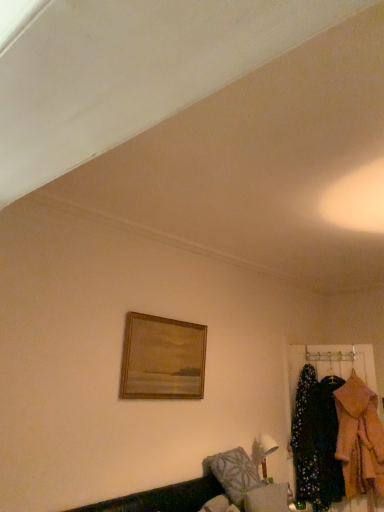
Question: Considering the relative positions of fluffy gray pillow at lower center and wooden framed painting at upper center in the image provided, is fluffy gray pillow at lower center behind wooden framed painting at upper center?

Choices:
 (A) yes
 (B) no

Answer: (A)

Question: Considering the relative sizes of fluffy gray pillow at lower center and wooden framed painting at upper center in the image provided, is fluffy gray pillow at lower center wider than wooden framed painting at upper center?

Choices:
 (A) no
 (B) yes

Answer: (B)

Question: From the image's perspective, is fluffy gray pillow at lower center located above wooden framed painting at upper center?

Choices:
 (A) yes
 (B) no

Answer: (B)

Question: Can you confirm if fluffy gray pillow at lower center is thinner than wooden framed painting at upper center?

Choices:
 (A) no
 (B) yes

Answer: (A)

Question: Does fluffy gray pillow at lower center touch wooden framed painting at upper center?

Choices:
 (A) yes
 (B) no

Answer: (B)

Question: Is fluffy gray pillow at lower center turned away from wooden framed painting at upper center?

Choices:
 (A) no
 (B) yes

Answer: (A)

Question: From a real-world perspective, is fluffy pink coat at right on fluffy gray pillow at lower center?

Choices:
 (A) no
 (B) yes

Answer: (B)

Question: Considering the relative sizes of fluffy pink coat at right and fluffy gray pillow at lower center in the image provided, is fluffy pink coat at right wider than fluffy gray pillow at lower center?

Choices:
 (A) no
 (B) yes

Answer: (A)

Question: Is fluffy pink coat at right at the left side of fluffy gray pillow at lower center?

Choices:
 (A) no
 (B) yes

Answer: (A)

Question: From the image's perspective, is fluffy pink coat at right below fluffy gray pillow at lower center?

Choices:
 (A) yes
 (B) no

Answer: (A)

Question: Is fluffy pink coat at right far from fluffy gray pillow at lower center?

Choices:
 (A) no
 (B) yes

Answer: (B)

Question: Is fluffy pink coat at right positioned beyond the bounds of fluffy gray pillow at lower center?

Choices:
 (A) no
 (B) yes

Answer: (B)

Question: Does wooden framed painting at upper center have a greater height compared to velvet green couch at lower right?

Choices:
 (A) no
 (B) yes

Answer: (B)